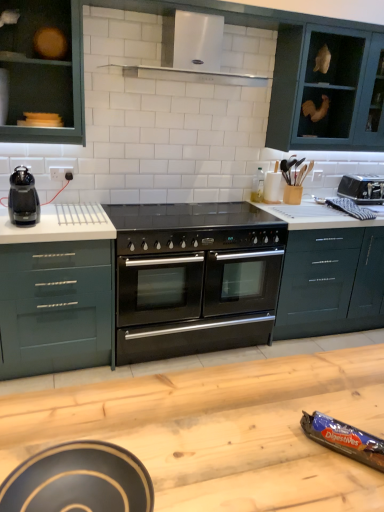
This screenshot has width=384, height=512. I want to click on free space in front of blue foil digestives at lower right, which is counted as the 2th appliance, starting from the top, so tap(352, 484).